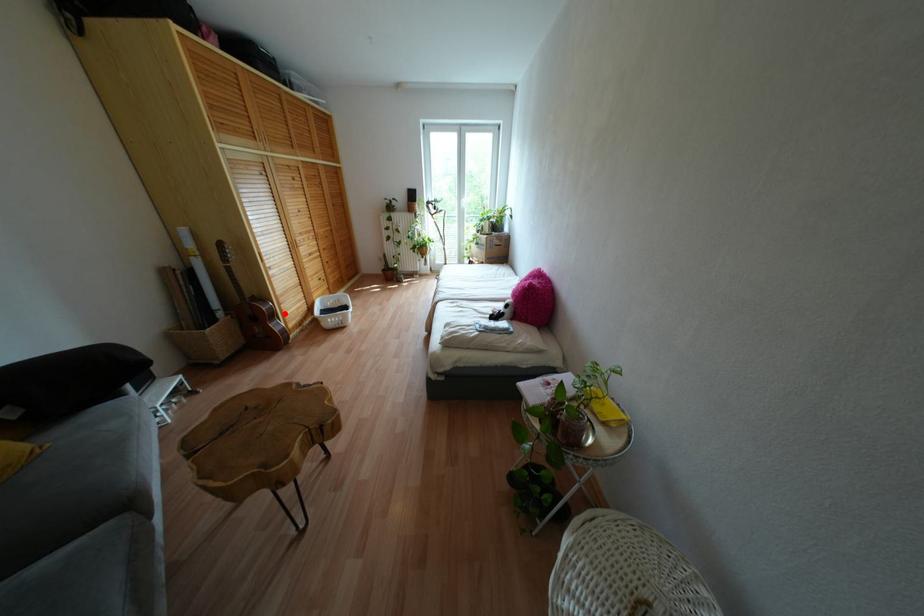
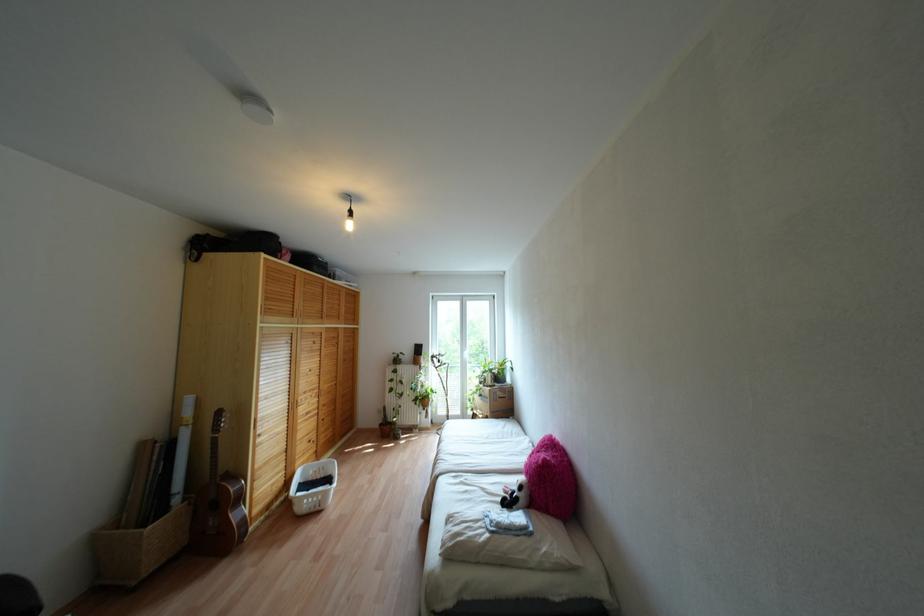
In the second image, find the point that corresponds to the highlighted location in the first image.

(253, 495)